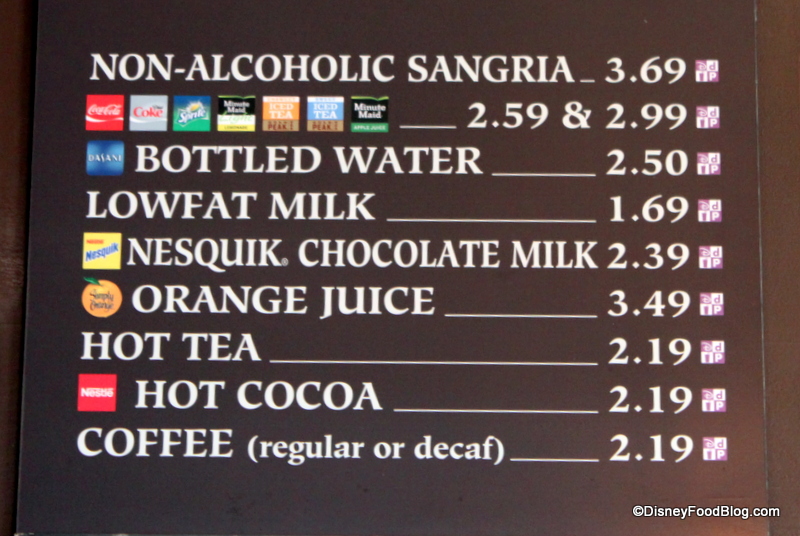
Locate an element on the screen. This screenshot has width=800, height=536. dark brown wooden surface is located at coordinates (x=20, y=185).